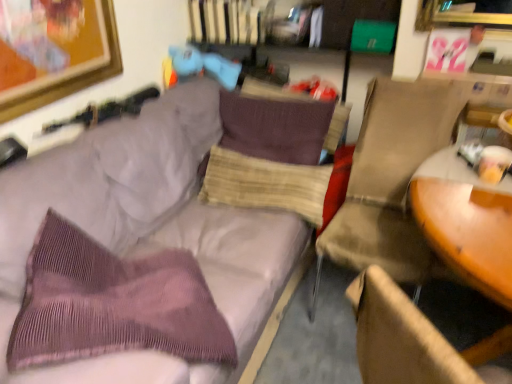
Question: In terms of width, does purple corduroy throw pillow at left look wider or thinner when compared to wooden round table at right?

Choices:
 (A) thin
 (B) wide

Answer: (A)

Question: From the image's perspective, is purple corduroy throw pillow at left located above or below wooden round table at right?

Choices:
 (A) above
 (B) below

Answer: (A)

Question: Which object is the farthest from the beige textured pillow at center, which is counted as the first pillow, starting from the bottom?

Choices:
 (A) purple corduroy pillow at center, marked as the 1th pillow in a top-to-bottom arrangement
 (B) purple corduroy throw pillow at left
 (C) matte blue plush at upper center
 (D) purple corduroy couch at upper left
 (E) beige fabric chair at right

Answer: (B)

Question: Estimate the real-world distances between objects in this image. Which object is closer to the beige textured pillow at center, which is counted as the first pillow, starting from the bottom?

Choices:
 (A) purple corduroy couch at upper left
 (B) beige fabric chair at right
 (C) matte blue plush at upper center
 (D) purple corduroy throw pillow at left
 (E) wooden round table at right

Answer: (A)